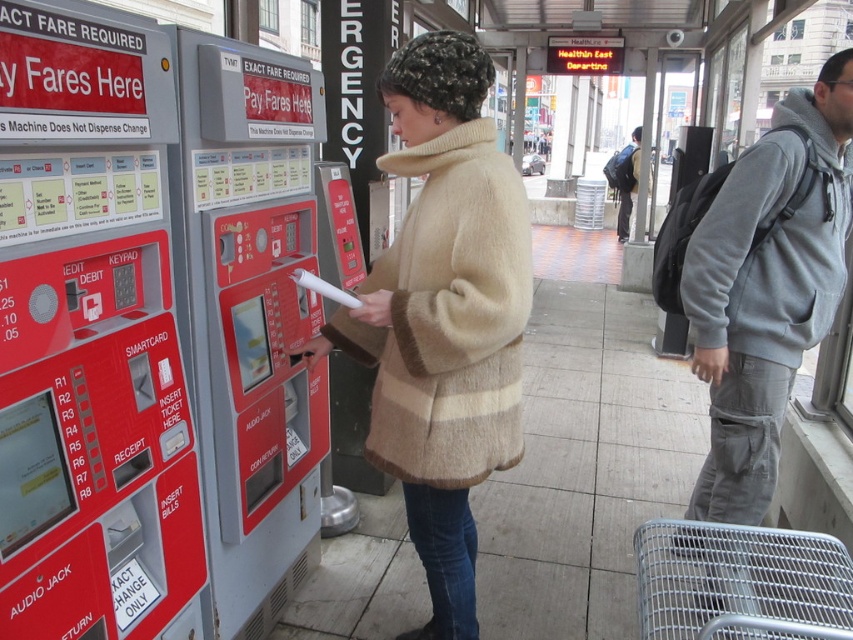
You are a traveler standing at the public transportation hub. You need to place both the gray fleece hoodie at right and the dark gray backpack at right on the bench next to the fare payment machine. The bench is only 1 meter wide. Can both items fit side by side on the bench without overlapping?

The gray fleece hoodie at right might be wider than dark gray backpack at right, so there is uncertainty about whether both items can fit side by side on the 1 meter wide bench. Measure their combined width to confirm.

You are a traveler at the transportation hub and need to determine which item is shorter between the gray fleece hoodie at right and the dark gray backpack at right. Which one is shorter?

The gray fleece hoodie at right is not as tall as dark gray backpack at right, so the gray fleece hoodie at right is shorter.